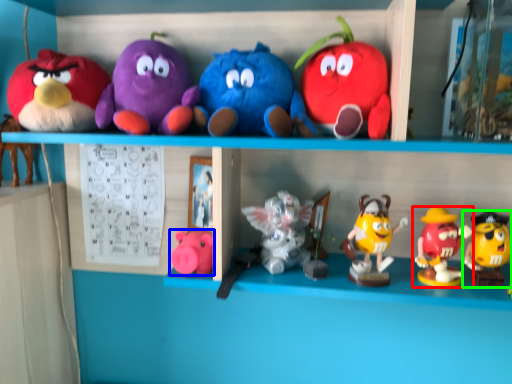
Question: Estimate the real-world distances between objects in this image. Which object is closer to toy (highlighted by a red box), toy (highlighted by a blue box) or toy (highlighted by a green box)?

Choices:
 (A) toy
 (B) toy

Answer: (B)